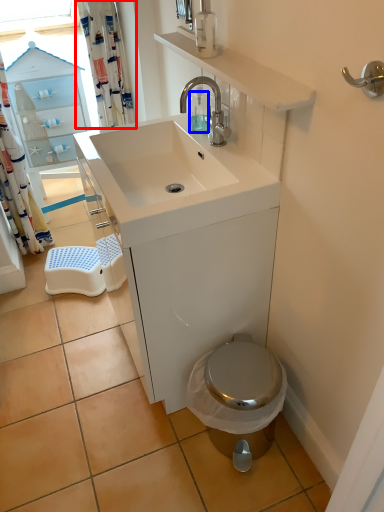
Question: Which point is closer to the camera, shower curtain (highlighted by a red box) or soap dispenser (highlighted by a blue box)?

Choices:
 (A) shower curtain
 (B) soap dispenser

Answer: (B)